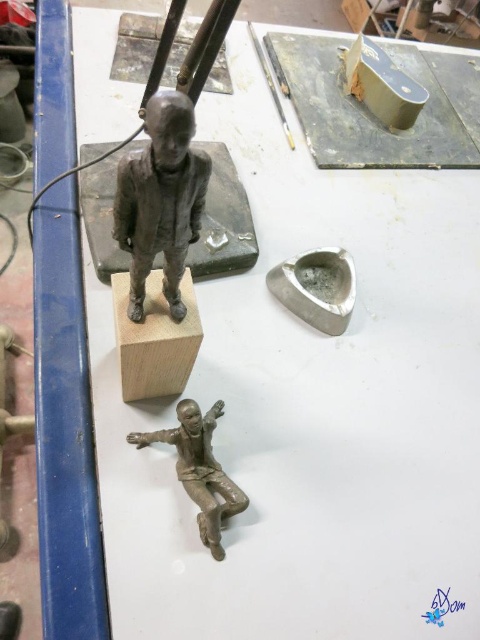
Image resolution: width=480 pixels, height=640 pixels. What do you see at coordinates (160, 198) in the screenshot?
I see `bronze statue at center` at bounding box center [160, 198].

The height and width of the screenshot is (640, 480). I want to click on bronze statue at center, so click(160, 198).